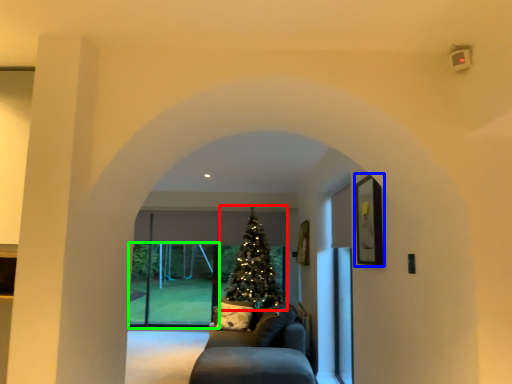
Question: Which is farther away from christmas tree (highlighted by a red box)? picture frame (highlighted by a blue box) or glass door (highlighted by a green box)?

Choices:
 (A) picture frame
 (B) glass door

Answer: (A)